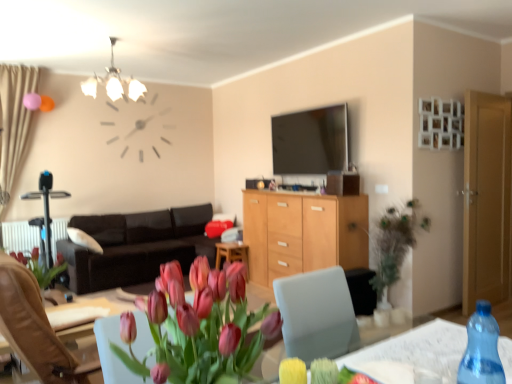
Question: Can we say beige fabric curtain at left lies outside green leafy plant at right?

Choices:
 (A) no
 (B) yes

Answer: (B)

Question: From a real-world perspective, is beige fabric curtain at left located higher than green leafy plant at right?

Choices:
 (A) no
 (B) yes

Answer: (B)

Question: Is beige fabric curtain at left closer to the viewer compared to green leafy plant at right?

Choices:
 (A) yes
 (B) no

Answer: (B)

Question: Is beige fabric curtain at left wider than green leafy plant at right?

Choices:
 (A) yes
 (B) no

Answer: (B)

Question: Considering the relative positions of beige fabric curtain at left and green leafy plant at right in the image provided, is beige fabric curtain at left behind green leafy plant at right?

Choices:
 (A) no
 (B) yes

Answer: (B)

Question: Looking at their shapes, would you say white plastic radiator at lower left is wider or thinner than wooden cabinet at center?

Choices:
 (A) wide
 (B) thin

Answer: (B)

Question: Based on their positions, is white plastic radiator at lower left located to the left or right of wooden cabinet at center?

Choices:
 (A) left
 (B) right

Answer: (A)

Question: Based on their sizes in the image, would you say white plastic radiator at lower left is bigger or smaller than wooden cabinet at center?

Choices:
 (A) big
 (B) small

Answer: (B)

Question: Which is correct: white plastic radiator at lower left is inside wooden cabinet at center, or outside of it?

Choices:
 (A) inside
 (B) outside

Answer: (B)

Question: Is point (105, 281) positioned closer to the camera than point (350, 218)?

Choices:
 (A) closer
 (B) farther

Answer: (B)

Question: From a real-world perspective, relative to wooden cabinet at center, is dark brown leather couch at center vertically above or below?

Choices:
 (A) above
 (B) below

Answer: (B)

Question: Looking at the image, does dark brown leather couch at center seem bigger or smaller compared to wooden cabinet at center?

Choices:
 (A) big
 (B) small

Answer: (A)

Question: Based on their positions, is dark brown leather couch at center located to the left or right of wooden cabinet at center?

Choices:
 (A) right
 (B) left

Answer: (B)

Question: From the image's perspective, is transparent plastic bottle at lower right located above or below matte pink tulips at center?

Choices:
 (A) below
 (B) above

Answer: (B)

Question: Looking at their shapes, would you say transparent plastic bottle at lower right is wider or thinner than matte pink tulips at center?

Choices:
 (A) thin
 (B) wide

Answer: (A)